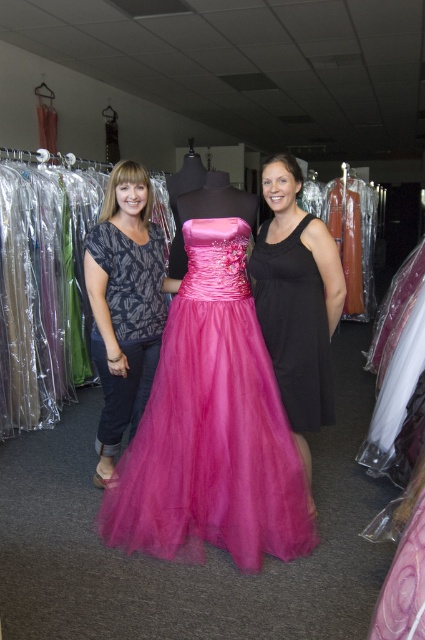
Does point (204, 221) come in front of point (320, 330)?

Yes.

How much distance is there between fuchsia tulle dress at center and satin tulle dress at center?

fuchsia tulle dress at center is 11.48 inches from satin tulle dress at center.

The image size is (425, 640). In order to click on fuchsia tulle dress at center in this screenshot , I will do `click(212, 428)`.

Does matte black blouse at center have a larger size compared to satin tulle dress at center?

Correct, matte black blouse at center is larger in size than satin tulle dress at center.

Does point (96, 323) lie behind point (329, 372)?

Yes, point (96, 323) is farther from viewer.

Find the location of `matte black blouse at center`. matte black blouse at center is located at coordinates (124, 305).

Can you confirm if fuchsia tulle dress at center is thinner than matte black blouse at center?

No, fuchsia tulle dress at center is not thinner than matte black blouse at center.

Between point (255, 541) and point (107, 396), which one is positioned behind?

The point (107, 396) is more distant.

Who is more forward, [212,321] or [122,225]?

Point [212,321] is more forward.

In order to click on fuchsia tulle dress at center in this screenshot , I will do `click(212, 428)`.